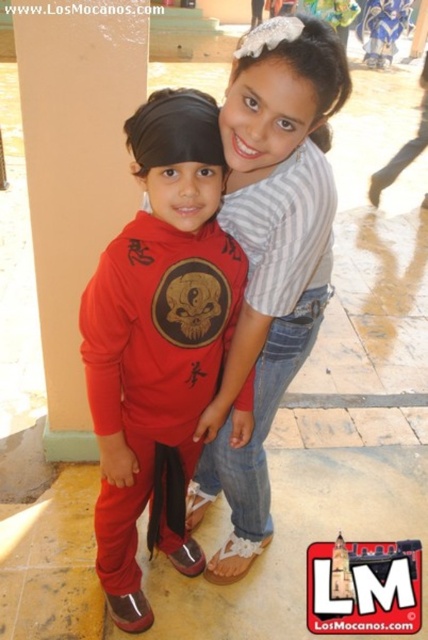
Question: Does striped cotton shirt at upper center have a larger size compared to matte beige pillar at left?

Choices:
 (A) no
 (B) yes

Answer: (A)

Question: Among these objects, which one is nearest to the camera?

Choices:
 (A) matte beige pillar at left
 (B) striped cotton shirt at upper center

Answer: (B)

Question: Based on their relative distances, which object is farther from the matte beige pillar at left?

Choices:
 (A) striped cotton shirt at upper center
 (B) matte red ninja suit at center

Answer: (A)

Question: Is striped cotton shirt at upper center smaller than matte beige pillar at left?

Choices:
 (A) yes
 (B) no

Answer: (A)

Question: Which object is positioned farthest from the matte beige pillar at left?

Choices:
 (A) striped cotton shirt at upper center
 (B) matte red ninja suit at center

Answer: (A)

Question: Does matte red ninja suit at center lie behind matte beige pillar at left?

Choices:
 (A) yes
 (B) no

Answer: (B)